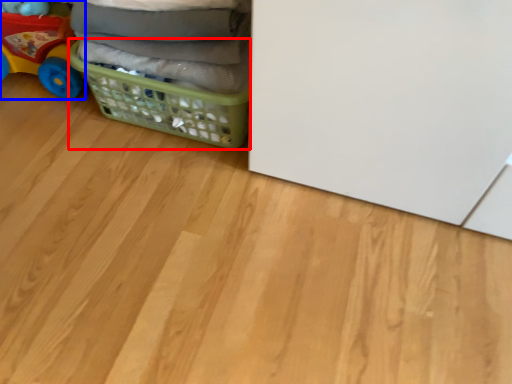
Question: Which object is closer to the camera taking this photo, basket (highlighted by a red box) or toy (highlighted by a blue box)?

Choices:
 (A) basket
 (B) toy

Answer: (A)